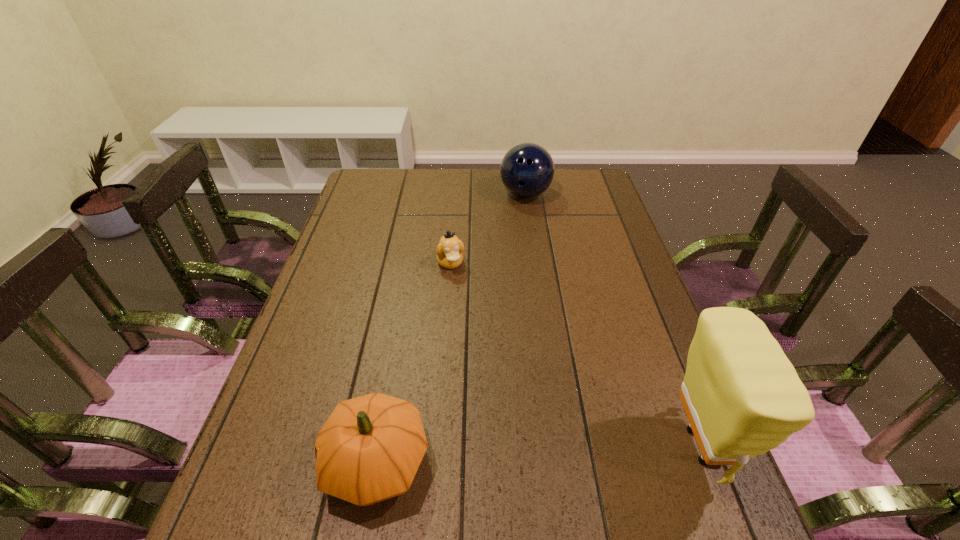
This screenshot has width=960, height=540. Find the location of `gourd`. gourd is located at coordinates (370, 448).

Image resolution: width=960 pixels, height=540 pixels. Find the location of `the tallest object`. the tallest object is located at coordinates (742, 396).

Identify the location of the rightmost object. (742, 396).

The width and height of the screenshot is (960, 540). I want to click on duckling, so click(x=449, y=251).

Locate an element on the screen. The image size is (960, 540). the second farthest object is located at coordinates (449, 251).

This screenshot has height=540, width=960. What are the coordinates of `the third object from left to right` in the screenshot? It's located at (527, 170).

This screenshot has width=960, height=540. I want to click on the farthest object, so click(x=527, y=170).

Where is `free region located on the side of the gourd with the carved face`? This screenshot has width=960, height=540. free region located on the side of the gourd with the carved face is located at coordinates (276, 463).

Find the location of a particular element. This screenshot has width=960, height=540. vacant point located 0.130m on the side of the gourd with the carved face is located at coordinates 255,463.

Locate an element on the screen. This screenshot has height=540, width=960. vacant space located on the side of the gourd with the carved face is located at coordinates (286, 463).